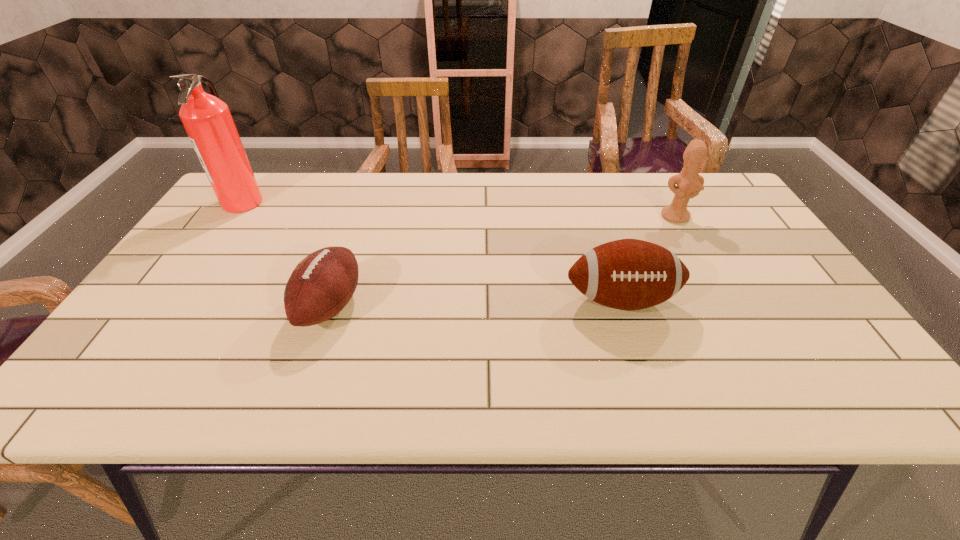
Identify the location of free location located 0.090m on the left of the shorter football (American). (261, 306).

Locate an element on the screen. fire extinguisher positioned at the far edge is located at coordinates (207, 120).

Image resolution: width=960 pixels, height=540 pixels. In order to click on figurine at the far edge in this screenshot , I will do `click(689, 183)`.

The height and width of the screenshot is (540, 960). Find the location of `object that is at the left edge`. object that is at the left edge is located at coordinates (207, 120).

In order to click on object located in the far left corner section of the desktop in this screenshot , I will do `click(207, 120)`.

The width and height of the screenshot is (960, 540). In the image, there is a desktop. Find the location of `vacant space at the far edge`. vacant space at the far edge is located at coordinates (307, 205).

Locate an element on the screen. vacant space at the near edge of the desktop is located at coordinates (303, 380).

This screenshot has height=540, width=960. Find the location of `free location at the left edge of the desktop`. free location at the left edge of the desktop is located at coordinates (194, 293).

Find the location of a particular element. The image size is (960, 540). vacant space at the far right corner of the desktop is located at coordinates (721, 190).

The image size is (960, 540). In order to click on vacant point located between the leftmost object and the right football (American) in this screenshot , I will do `click(432, 251)`.